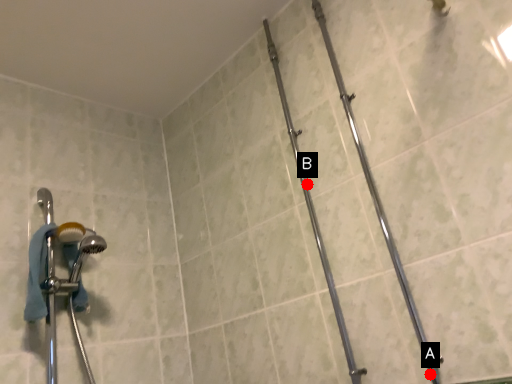
Question: Two points are circled on the image, labeled by A and B beside each circle. Which point appears closest to the camera in this image?

Choices:
 (A) A is closer
 (B) B is closer

Answer: (A)